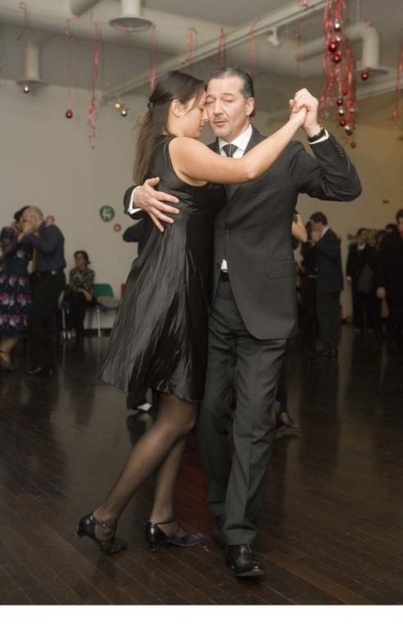
Question: Which object is positioned closest to the black satin dress at center?

Choices:
 (A) shiny black dress at center
 (B) dark gray suit at right

Answer: (A)

Question: Does matte black suit at left have a smaller size compared to satin black dress at lower left?

Choices:
 (A) no
 (B) yes

Answer: (A)

Question: Does shiny black dress at center have a smaller size compared to dark gray suit at right?

Choices:
 (A) no
 (B) yes

Answer: (B)

Question: Which point appears closest to the camera in this image?

Choices:
 (A) tap(6, 364)
 (B) tap(355, 244)
 (C) tap(81, 273)

Answer: (A)

Question: Which point is closer to the camera?

Choices:
 (A) matte black suit at left
 (B) black satin dress at center
 (C) shiny black dress at left
 (D) satin black dress at lower left

Answer: (B)

Question: Is black satin dress at center closer to the viewer compared to shiny black dress at left?

Choices:
 (A) no
 (B) yes

Answer: (B)